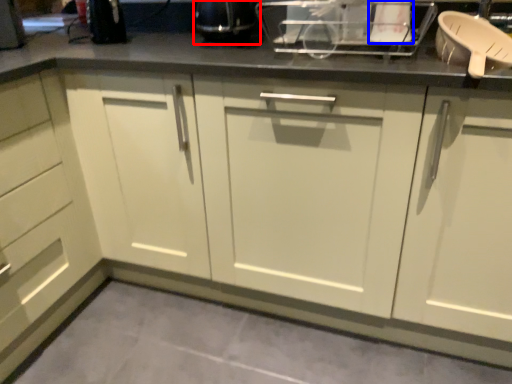
Question: Among these objects, which one is farthest to the camera, appliance (highlighted by a red box) or appliance (highlighted by a blue box)?

Choices:
 (A) appliance
 (B) appliance

Answer: (A)